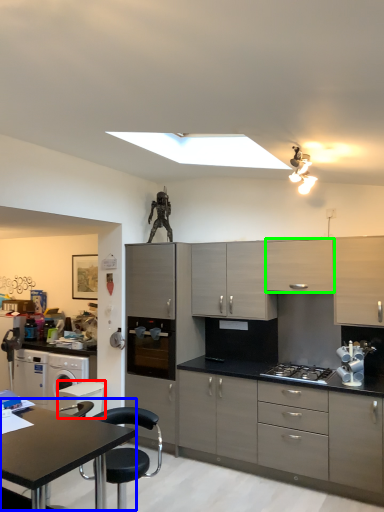
Question: Considering the real-world distances, which object is closest to appliance (highlighted by a red box)? table (highlighted by a blue box) or cabinetry (highlighted by a green box).

Choices:
 (A) table
 (B) cabinetry

Answer: (A)